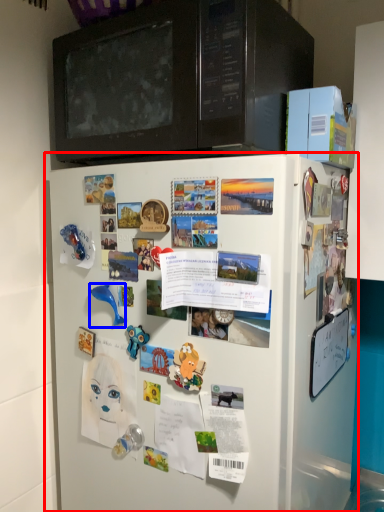
Question: Which point is closer to the camera, refrigerator (highlighted by a red box) or toy (highlighted by a blue box)?

Choices:
 (A) refrigerator
 (B) toy

Answer: (A)